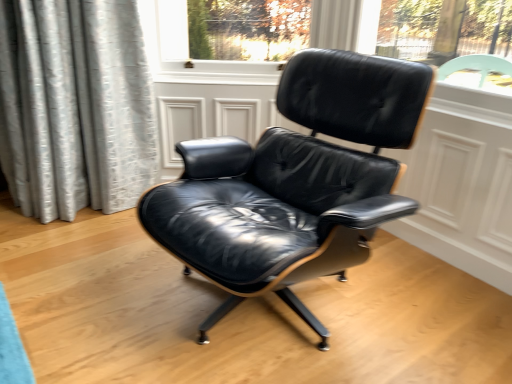
Question: Can you confirm if black leather chair at center is thinner than black leather screen door at center?

Choices:
 (A) no
 (B) yes

Answer: (A)

Question: Is black leather chair at center outside of black leather screen door at center?

Choices:
 (A) yes
 (B) no

Answer: (A)

Question: Does black leather chair at center turn towards black leather screen door at center?

Choices:
 (A) no
 (B) yes

Answer: (A)

Question: Considering the relative sizes of black leather chair at center and black leather screen door at center in the image provided, is black leather chair at center shorter than black leather screen door at center?

Choices:
 (A) no
 (B) yes

Answer: (A)

Question: Would you say black leather chair at center contains black leather screen door at center?

Choices:
 (A) no
 (B) yes

Answer: (A)

Question: Can you confirm if black leather chair at center is bigger than black leather screen door at center?

Choices:
 (A) yes
 (B) no

Answer: (A)

Question: From a real-world perspective, is black leather screen door at center on black leather chair at center?

Choices:
 (A) yes
 (B) no

Answer: (B)

Question: Considering the relative positions of black leather screen door at center and black leather chair at center in the image provided, is black leather screen door at center to the left of black leather chair at center from the viewer's perspective?

Choices:
 (A) no
 (B) yes

Answer: (B)

Question: From the image's perspective, is black leather screen door at center located above black leather chair at center?

Choices:
 (A) yes
 (B) no

Answer: (A)

Question: Does black leather screen door at center contain black leather chair at center?

Choices:
 (A) no
 (B) yes

Answer: (A)

Question: Is black leather screen door at center in front of black leather chair at center?

Choices:
 (A) yes
 (B) no

Answer: (B)

Question: From the image's perspective, is black leather screen door at center located beneath black leather chair at center?

Choices:
 (A) yes
 (B) no

Answer: (B)

Question: Would you say black leather chair at center is to the left or to the right of black leather screen door at center in the picture?

Choices:
 (A) right
 (B) left

Answer: (A)